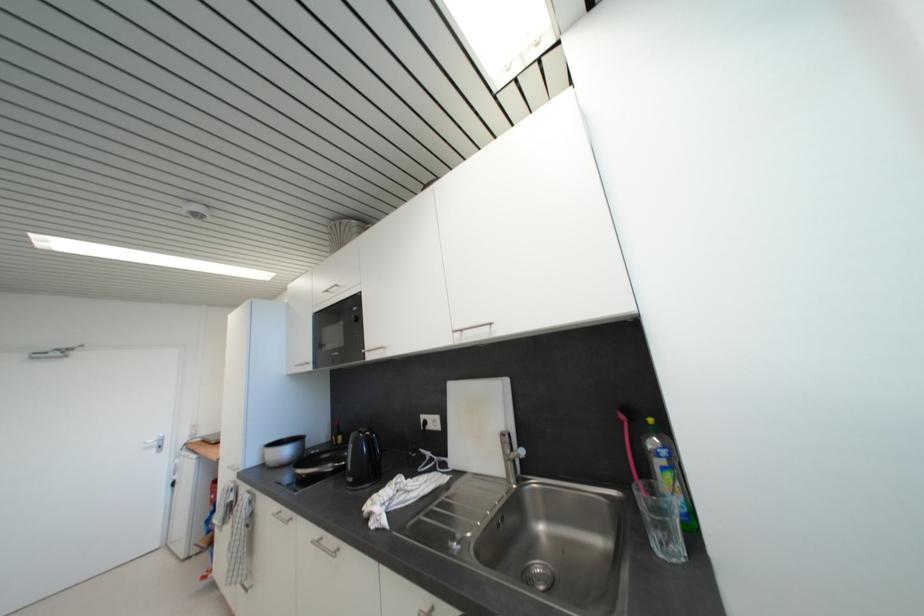
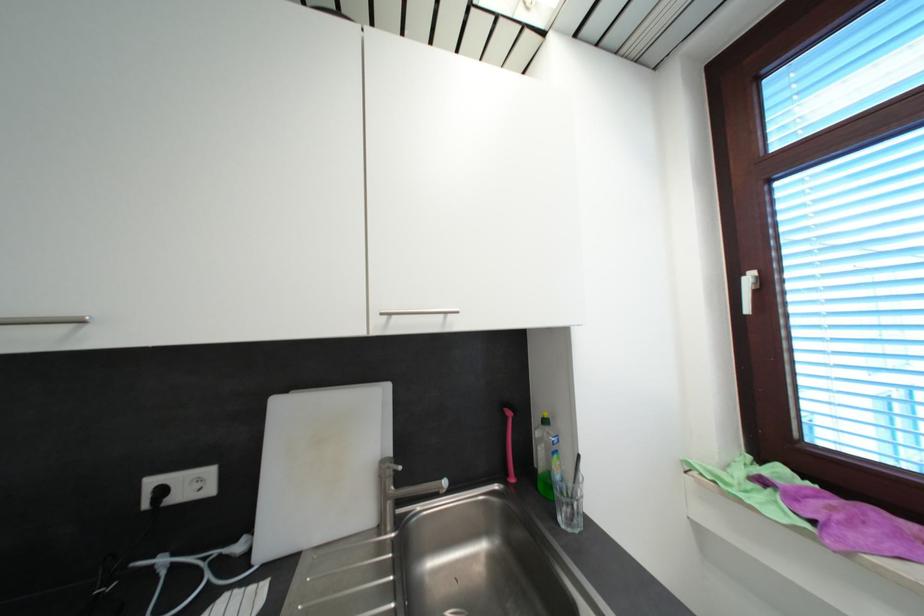
Locate, in the second image, the point that corresponds to pixel 467 333 in the first image.

(395, 315)